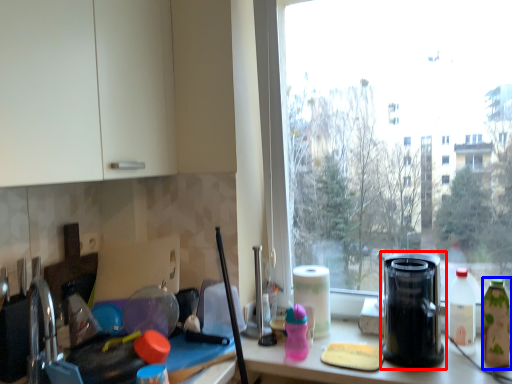
Question: Which object is closer to the camera taking this photo, kitchen appliance (highlighted by a red box) or bottle (highlighted by a blue box)?

Choices:
 (A) kitchen appliance
 (B) bottle

Answer: (A)